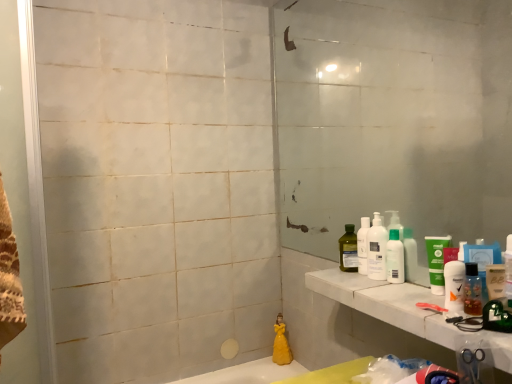
Question: From the image's perspective, is green matte tube at right, arranged as the 1th mouthwash when viewed from the back, on clear glass screen door at left?

Choices:
 (A) no
 (B) yes

Answer: (A)

Question: Is green matte tube at right, arranged as the 1th mouthwash when viewed from the back, to the left of clear glass screen door at left from the viewer's perspective?

Choices:
 (A) yes
 (B) no

Answer: (B)

Question: Could you tell me if green matte tube at right, marked as the 2th mouthwash in a front-to-back arrangement, is facing clear glass screen door at left?

Choices:
 (A) yes
 (B) no

Answer: (A)

Question: Is green matte tube at right, arranged as the 1th mouthwash when viewed from the back, with clear glass screen door at left?

Choices:
 (A) no
 (B) yes

Answer: (A)

Question: Can you confirm if green matte tube at right, arranged as the 1th mouthwash when viewed from the back, is taller than clear glass screen door at left?

Choices:
 (A) no
 (B) yes

Answer: (A)

Question: Are green matte tube at right, arranged as the 1th mouthwash when viewed from the back, and clear glass screen door at left located far from each other?

Choices:
 (A) no
 (B) yes

Answer: (B)

Question: Considering the relative sizes of white marble counter top at right and translucent plastic bottle at right, the 1th mouthwash viewed from the front, in the image provided, is white marble counter top at right wider than translucent plastic bottle at right, the 1th mouthwash viewed from the front,?

Choices:
 (A) no
 (B) yes

Answer: (B)

Question: From a real-world perspective, does white marble counter top at right sit lower than translucent plastic bottle at right, marked as the second mouthwash in a back-to-front arrangement?

Choices:
 (A) yes
 (B) no

Answer: (A)

Question: Is white marble counter top at right not close to translucent plastic bottle at right, the 1th mouthwash viewed from the front?

Choices:
 (A) yes
 (B) no

Answer: (B)

Question: Is white marble counter top at right to the right of translucent plastic bottle at right, marked as the second mouthwash in a back-to-front arrangement, from the viewer's perspective?

Choices:
 (A) yes
 (B) no

Answer: (B)

Question: Is white marble counter top at right taller than translucent plastic bottle at right, marked as the second mouthwash in a back-to-front arrangement?

Choices:
 (A) yes
 (B) no

Answer: (B)

Question: Considering the relative sizes of white marble counter top at right and translucent plastic bottle at right, the 1th mouthwash viewed from the front, in the image provided, is white marble counter top at right bigger than translucent plastic bottle at right, the 1th mouthwash viewed from the front,?

Choices:
 (A) yes
 (B) no

Answer: (A)

Question: Does white plastic bottles at right, the 1th cleaning product positioned from the top, have a greater width compared to clear glass screen door at left?

Choices:
 (A) yes
 (B) no

Answer: (B)